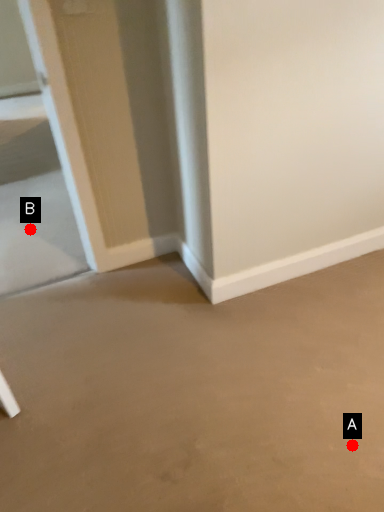
Question: Two points are circled on the image, labeled by A and B beside each circle. Among these points, which one is nearest to the camera?

Choices:
 (A) A is closer
 (B) B is closer

Answer: (A)